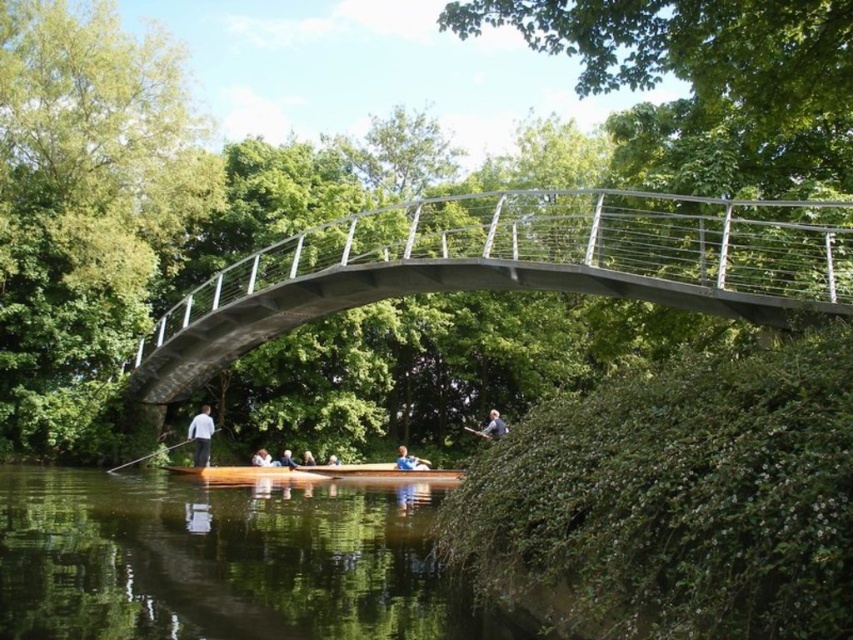
You are standing on the modern arched bridge and looking down at the scene below. You see the brown wood river at lower center and the light brown wooden paddle at center. Which object is closer to you from your vantage point on the bridge?

The brown wood river at lower center is closer to you because it is in front of the light brown wooden paddle at center from your viewpoint on the bridge.

From the picture: You are standing on the modern arched bridge and looking down at the scene below. You see the brown wood river at lower center and the blue fabric boat at center. Which object is positioned higher from your viewpoint?

The brown wood river at lower center is located above the blue fabric boat at center, so it is positioned higher from your viewpoint on the bridge.

You are standing at the center of the modern arched bridge and want to locate the brown wood river at lower center. Based on the coordinates provided, in which direction should you look to see it?

The brown wood river at lower center is located at coordinates point (223,561), so you should look downward and slightly to the right to see it.